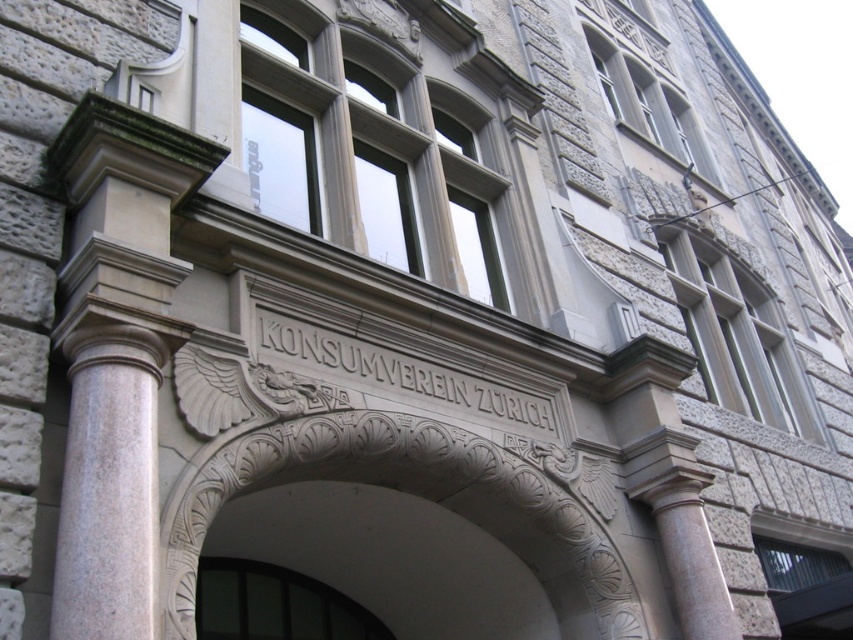
Is point (258, 44) more distant than point (703, 253)?

No, it is not.

What do you see at coordinates (368, 141) in the screenshot?
I see `matte stone window at center` at bounding box center [368, 141].

Who is more forward, (416, 120) or (740, 310)?

Point (416, 120) is more forward.

Find the location of `matte stone window at center`. matte stone window at center is located at coordinates (368, 141).

Is gray stone window at upper right positioned in front of transparent glass door at center?

That is False.

Can you confirm if gray stone window at upper right is positioned below transparent glass door at center?

No.

What are the coordinates of `gray stone window at upper right` in the screenshot? It's located at (734, 332).

Identify the location of gray stone window at upper right. (734, 332).

Between matte stone window at center and stone textured window at upper center, which one has more height?

With more height is matte stone window at center.

The height and width of the screenshot is (640, 853). In order to click on matte stone window at center in this screenshot , I will do `click(368, 141)`.

I want to click on matte stone window at center, so click(368, 141).